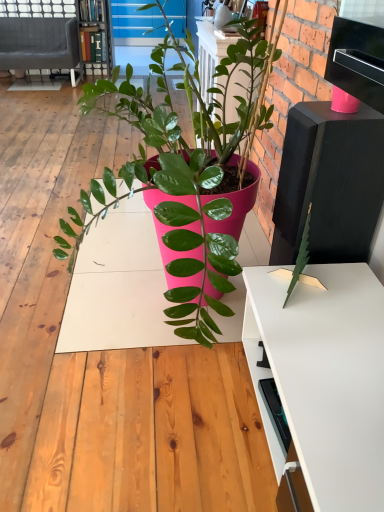
Describe the element at coordinates (39, 44) in the screenshot. This screenshot has height=512, width=384. I see `velvet grey couch at upper left` at that location.

Locate an element on the screen. The image size is (384, 512). velvet grey couch at upper left is located at coordinates (39, 44).

Image resolution: width=384 pixels, height=512 pixels. What do you see at coordinates (95, 35) in the screenshot?
I see `wooden bookshelf at upper left` at bounding box center [95, 35].

Image resolution: width=384 pixels, height=512 pixels. I want to click on wooden bookshelf at upper left, so click(95, 35).

The image size is (384, 512). I want to click on velvet grey couch at upper left, so click(39, 44).

Based on their positions, is velvet grey couch at upper left located to the left or right of wooden bookshelf at upper left?

velvet grey couch at upper left is positioned on wooden bookshelf at upper left's left side.

Is the depth of velvet grey couch at upper left less than that of wooden bookshelf at upper left?

Yes, velvet grey couch at upper left is closer to the camera.

Which is less distant, (26, 66) or (79, 1)?

Point (26, 66) is farther from the camera than point (79, 1).

From the image's perspective, is velvet grey couch at upper left located beneath wooden bookshelf at upper left?

Yes, from the image's perspective, velvet grey couch at upper left is beneath wooden bookshelf at upper left.

From a real-world perspective, is velvet grey couch at upper left under wooden bookshelf at upper left?

Indeed, from a real-world perspective, velvet grey couch at upper left is positioned beneath wooden bookshelf at upper left.

Looking at their sizes, would you say velvet grey couch at upper left is wider or thinner than wooden bookshelf at upper left?

In the image, velvet grey couch at upper left appears to be wider than wooden bookshelf at upper left.

Considering the sizes of velvet grey couch at upper left and wooden bookshelf at upper left in the image, is velvet grey couch at upper left taller or shorter than wooden bookshelf at upper left?

Clearly, velvet grey couch at upper left is shorter compared to wooden bookshelf at upper left.

Based on the photo, considering the relative sizes of velvet grey couch at upper left and wooden bookshelf at upper left in the image provided, is velvet grey couch at upper left smaller than wooden bookshelf at upper left?

No.

Can we say velvet grey couch at upper left lies outside wooden bookshelf at upper left?

Indeed, velvet grey couch at upper left is completely outside wooden bookshelf at upper left.

Is velvet grey couch at upper left positioned far away from wooden bookshelf at upper left?

They are positioned close to each other.

Could you tell me if velvet grey couch at upper left is facing wooden bookshelf at upper left?

No.

Find the location of a particular element. The height and width of the screenshot is (512, 384). bookshelf above the velvet grey couch at upper left (from the image's perspective) is located at coordinates (95, 35).

Does wooden bookshelf at upper left appear on the right side of velvet grey couch at upper left?

Yes, wooden bookshelf at upper left is to the right of velvet grey couch at upper left.

Is wooden bookshelf at upper left closer to the viewer compared to velvet grey couch at upper left?

No, it is behind velvet grey couch at upper left.

Is point (85, 58) positioned in front of point (60, 47)?

Yes, point (85, 58) is closer to viewer.

From the image's perspective, is wooden bookshelf at upper left located above velvet grey couch at upper left?

Yes.

From a real-world perspective, is wooden bookshelf at upper left located higher than velvet grey couch at upper left?

Yes, from a real-world perspective, wooden bookshelf at upper left is on top of velvet grey couch at upper left.

Looking at this image, which of these two, wooden bookshelf at upper left or velvet grey couch at upper left, is wider?

velvet grey couch at upper left is wider.

Does wooden bookshelf at upper left have a greater height compared to velvet grey couch at upper left?

Yes.

Is wooden bookshelf at upper left smaller than velvet grey couch at upper left?

Yes.

Is wooden bookshelf at upper left spatially inside velvet grey couch at upper left, or outside of it?

wooden bookshelf at upper left cannot be found inside velvet grey couch at upper left.

From the picture: Are wooden bookshelf at upper left and velvet grey couch at upper left far apart?

Actually, wooden bookshelf at upper left and velvet grey couch at upper left are a little close together.

Based on the photo, could you tell me if wooden bookshelf at upper left is turned towards velvet grey couch at upper left?

No, wooden bookshelf at upper left is not facing towards velvet grey couch at upper left.

What's the angular difference between wooden bookshelf at upper left and velvet grey couch at upper left's facing directions?

0.0925 degrees separate the facing orientations of wooden bookshelf at upper left and velvet grey couch at upper left.

The image size is (384, 512). What are the coordinates of `studio couch beneath the wooden bookshelf at upper left (from a real-world perspective)` in the screenshot? It's located at (39, 44).

Find the location of a particular element. Image resolution: width=384 pixels, height=512 pixels. studio couch in front of the wooden bookshelf at upper left is located at coordinates click(39, 44).

In order to click on bookshelf that is behind the velvet grey couch at upper left in this screenshot , I will do coord(95,35).